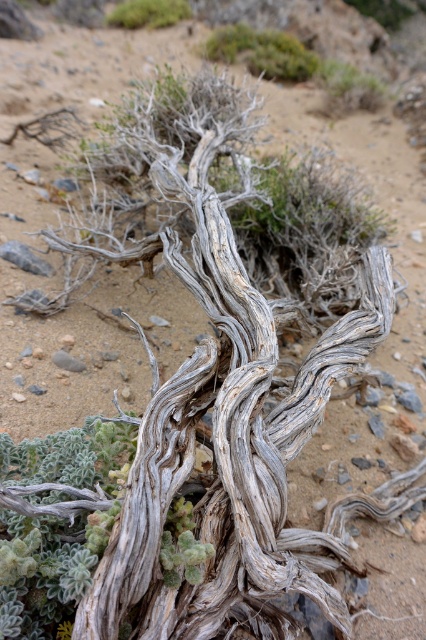
Between point (2, 460) and point (126, 19), which one is positioned behind?

The point (126, 19) is behind.

Which is in front, point (5, 440) or point (127, 13)?

Point (5, 440) is in front.

Is point (60, 637) farther from camera compared to point (175, 17)?

No, (60, 637) is in front of (175, 17).

The width and height of the screenshot is (426, 640). Identify the location of gray textured root at center. (57, 522).

Between green leafy plant at upper center and green fuzzy plant at upper center, which one has less height?

green fuzzy plant at upper center

Is point (265, 49) positioned in front of point (175, 6)?

Yes, point (265, 49) is closer to viewer.

Where is `green leafy plant at upper center`? This screenshot has height=640, width=426. green leafy plant at upper center is located at coordinates (262, 51).

Measure the distance between point (85, 536) and camera.

They are 4.84 feet apart.

Between gray textured root at center and green leafy plant at upper center, which one is positioned lower?

gray textured root at center is lower down.

What do you see at coordinates (57, 522) in the screenshot? The height and width of the screenshot is (640, 426). I see `gray textured root at center` at bounding box center [57, 522].

In order to click on gray textured root at center in this screenshot , I will do `click(57, 522)`.